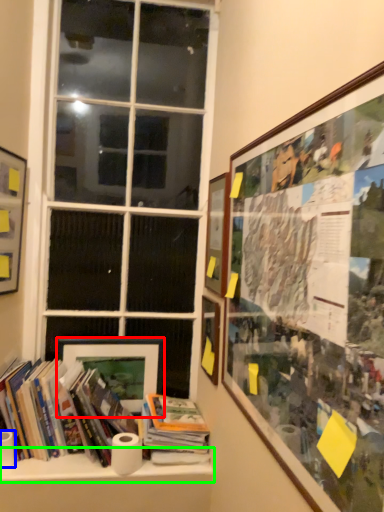
Question: Which is farther away from picture frame (highlighted by a red box)? paper towel (highlighted by a blue box) or window sill (highlighted by a green box)?

Choices:
 (A) paper towel
 (B) window sill

Answer: (A)